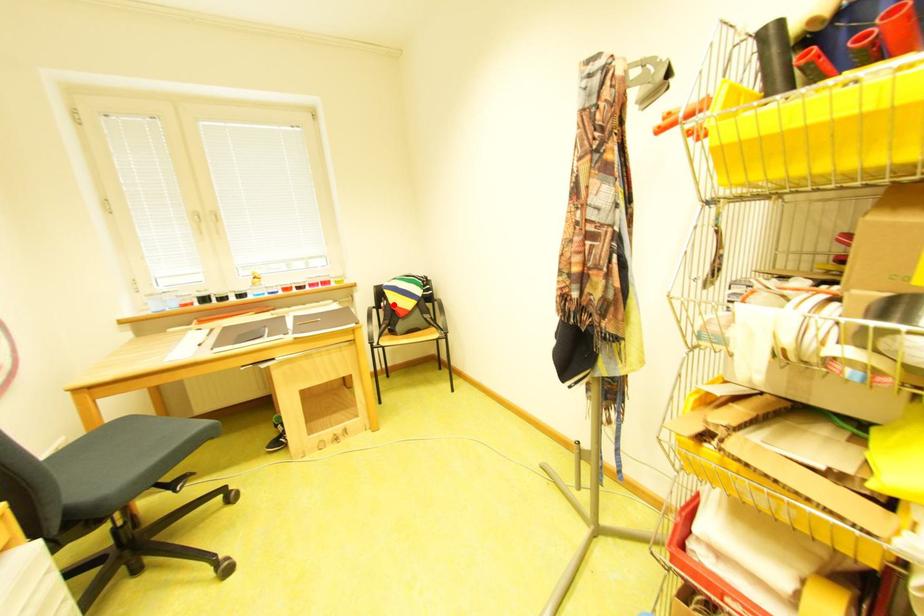
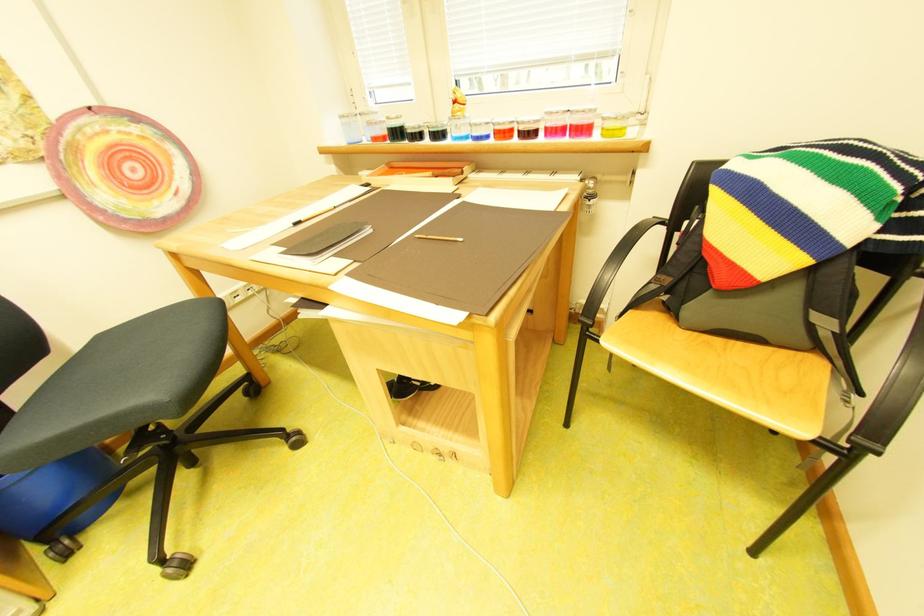
Where in the second image is the point corresponding to the highlighted location from the first image?

(698, 224)